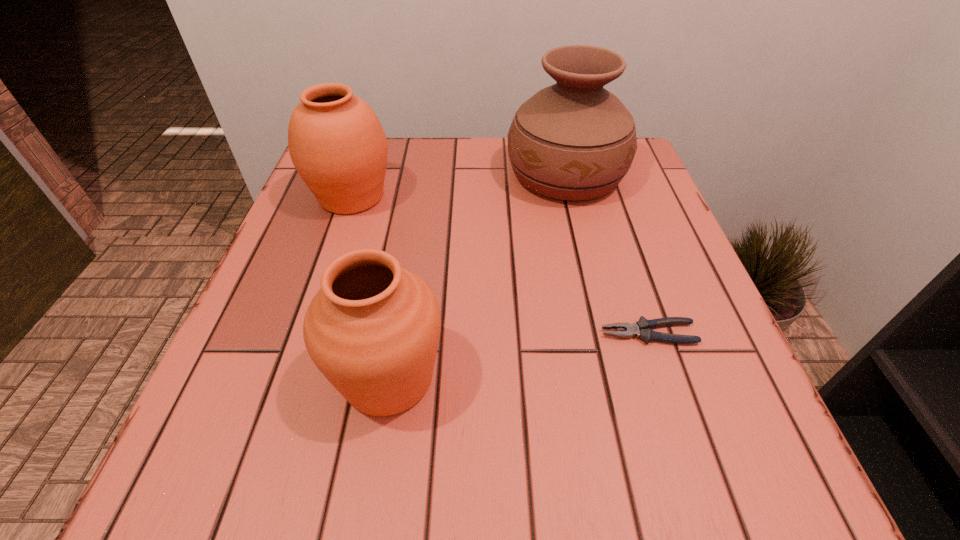
This screenshot has width=960, height=540. Find the location of `the rightmost urn`. the rightmost urn is located at coordinates (574, 140).

Locate an element on the screen. the nearest urn is located at coordinates pos(373,328).

Find the location of a particular element. Image resolution: width=960 pixels, height=540 pixels. the shortest object is located at coordinates [x=642, y=329].

I want to click on vacant area located 0.230m on the front of the rightmost urn, so click(x=594, y=292).

At what (x,y) coordinates should I click in order to perform the action: click on free space located 0.220m on the right of the nearest urn. Please return your answer as a coordinate pair (x, y). Looking at the image, I should click on (594, 377).

The width and height of the screenshot is (960, 540). What are the coordinates of `vacant space located at the gripping part of the shortest object` in the screenshot? It's located at [564, 334].

I want to click on free region located 0.180m at the gripping part of the shortest object, so click(x=490, y=334).

Identify the location of vacant region located 0.400m at the gripping part of the shortest object. (352, 334).

What are the coordinates of `object at the near edge` in the screenshot? It's located at (373, 328).

I want to click on object that is at the left edge, so click(337, 144).